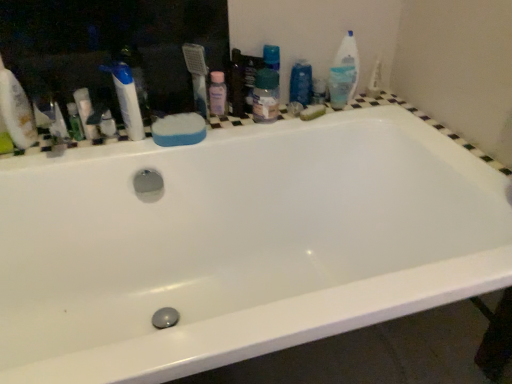
Where is `vacant area that is situated to the right of translucent plastic bottle at upper right, the 1th toiletry viewed from the right`? vacant area that is situated to the right of translucent plastic bottle at upper right, the 1th toiletry viewed from the right is located at coordinates (373, 102).